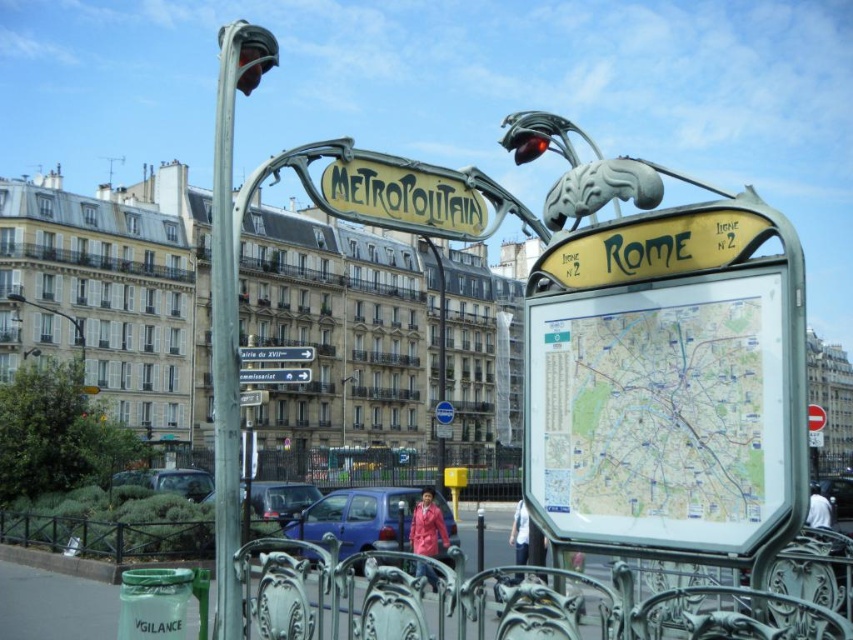
Question: Observing the image, what is the correct spatial positioning of silver metallic pole at left in reference to metallic sign at center?

Choices:
 (A) above
 (B) below

Answer: (A)

Question: Among these objects, which one is nearest to the camera?

Choices:
 (A) metallic yellow sign at center
 (B) brushed metal streetlight at upper left

Answer: (A)

Question: Is silver metallic pole at left to the right of yellow/golden metal sign at center from the viewer's perspective?

Choices:
 (A) no
 (B) yes

Answer: (A)

Question: Which point is farther to the camera?

Choices:
 (A) (78, 324)
 (B) (51, 593)

Answer: (A)

Question: Which point is closer to the camera taking this photo?

Choices:
 (A) (283, 381)
 (B) (409, 481)

Answer: (A)

Question: Does paper map at center appear over metallic chain-link fence at lower center?

Choices:
 (A) yes
 (B) no

Answer: (A)